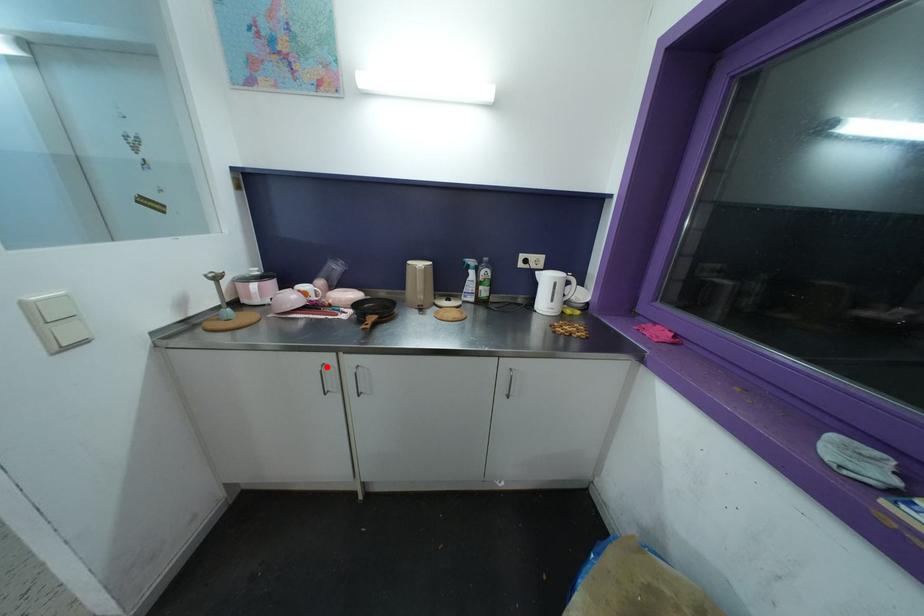
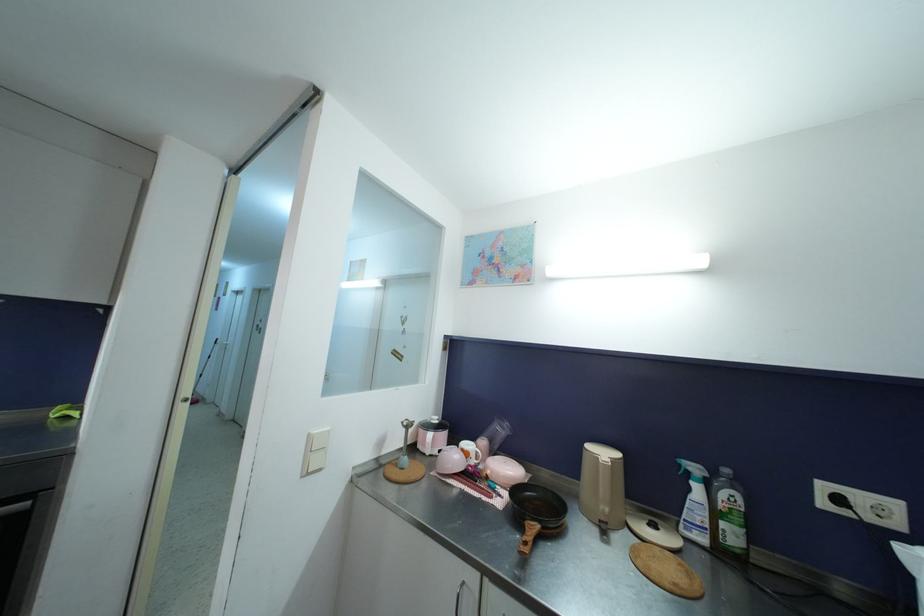
Locate, in the second image, the point that corresponds to the highlighted location in the first image.

(467, 586)